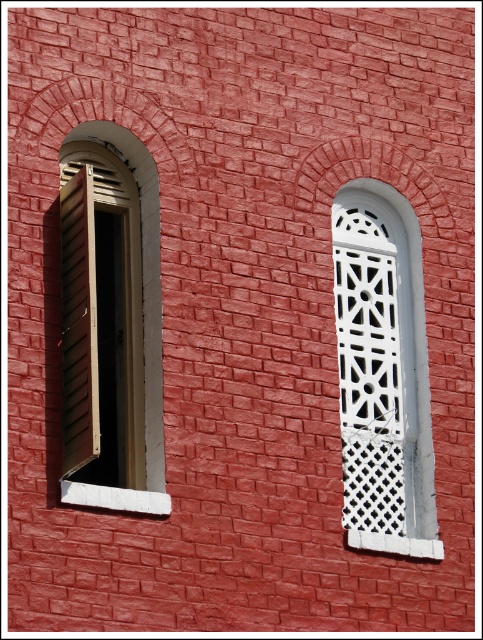
You are an architect designing a new building and want to replicate the window arrangement seen in the image. In the original image, where is the white lattice at center positioned relative to the wooden slats at left?

The white lattice at center is positioned below the wooden slats at left in the original image.

You are standing in front of the building and want to touch both the white lattice at center and the wooden slats at left. Which object will you reach first?

You will reach the white lattice at center first because it is closer to you than the wooden slats at left, which are further away.